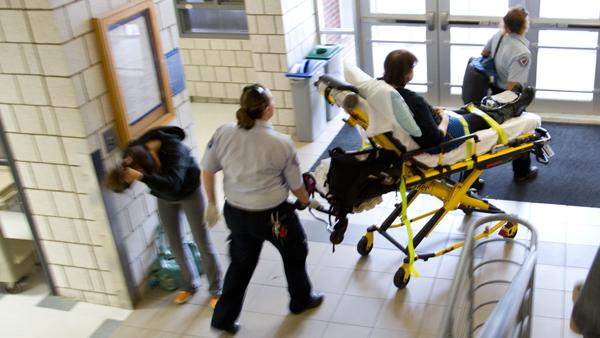
Where is `door hadle`? The image size is (600, 338). door hadle is located at coordinates (406, 22), (479, 20).